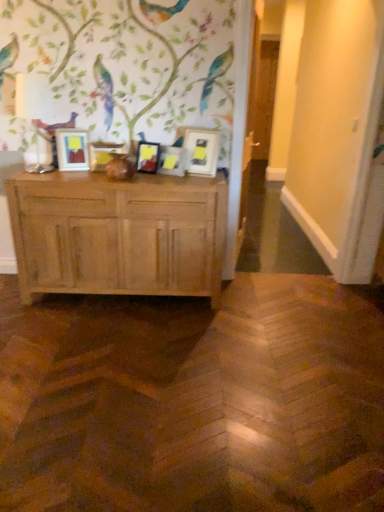
Question: Visually, is matte white picture frame at center, the 1th picture frame in the right-to-left sequence, positioned to the left or to the right of matte wooden picture frame at center, which ranks as the third picture frame in left-to-right order?

Choices:
 (A) left
 (B) right

Answer: (B)

Question: Is matte white picture frame at center, the 1th picture frame in the right-to-left sequence, situated inside matte wooden picture frame at center, which ranks as the third picture frame in left-to-right order, or outside?

Choices:
 (A) inside
 (B) outside

Answer: (B)

Question: Which object is the closest to the matte wooden picture frame at center, which ranks as the third picture frame in left-to-right order?

Choices:
 (A) matte wooden picture frame at center, which is the 2th picture frame from left to right
 (B) matte white picture frame at center, marked as the fourth picture frame in a left-to-right arrangement
 (C) light brown wood chest of drawers at center
 (D) matte wooden picture frame at left, arranged as the first picture frame when viewed from the left
 (E) matte white picture frame at center, which ranks as the 5th picture frame in left-to-right order

Answer: (B)

Question: Which object is positioned closest to the matte white picture frame at center, marked as the fourth picture frame in a left-to-right arrangement?

Choices:
 (A) matte wooden picture frame at center, which appears as the fourth picture frame when viewed from the right
 (B) matte wooden picture frame at center, which appears as the third picture frame when viewed from the right
 (C) matte white picture frame at center, the 1th picture frame in the right-to-left sequence
 (D) light brown wood chest of drawers at center
 (E) matte wooden picture frame at left, arranged as the first picture frame when viewed from the left

Answer: (B)